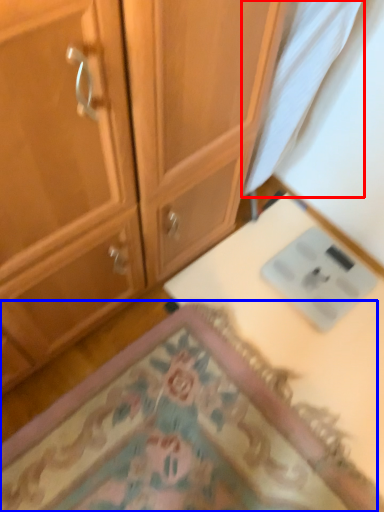
Question: Which of the following is the closest to the observer, fabric (highlighted by a red box) or mat (highlighted by a blue box)?

Choices:
 (A) fabric
 (B) mat

Answer: (A)